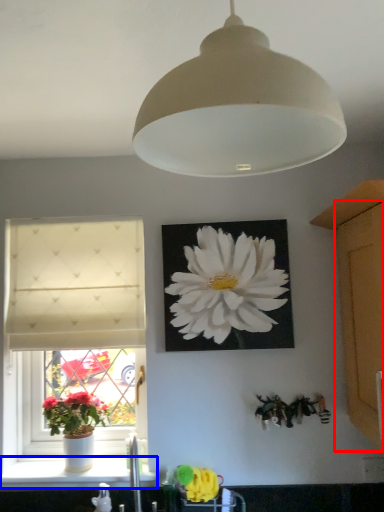
Question: Which of the following is the closest to the observer, glass door (highlighted by a red box) or window sill (highlighted by a blue box)?

Choices:
 (A) glass door
 (B) window sill

Answer: (A)